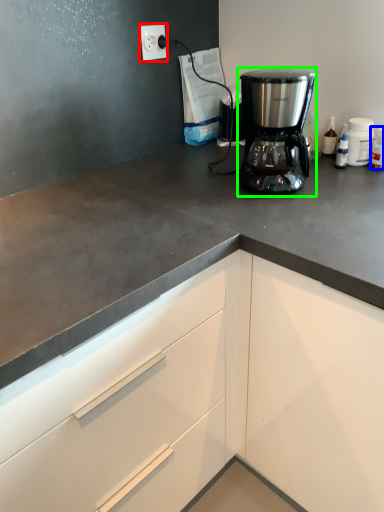
Question: Which object is the farthest from electric outlet (highlighted by a red box)? Choose among these: bottle (highlighted by a blue box) or coffee maker (highlighted by a green box).

Choices:
 (A) bottle
 (B) coffee maker

Answer: (A)